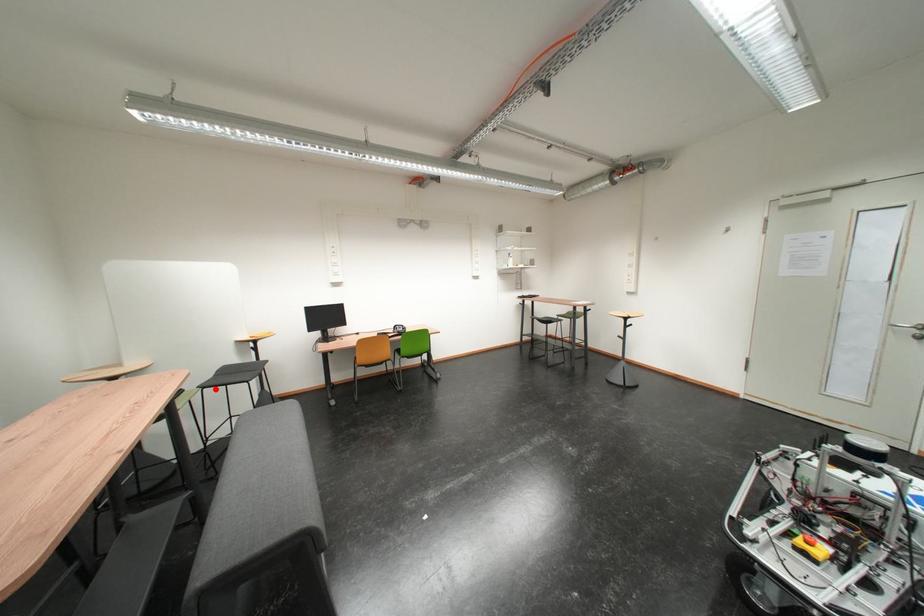
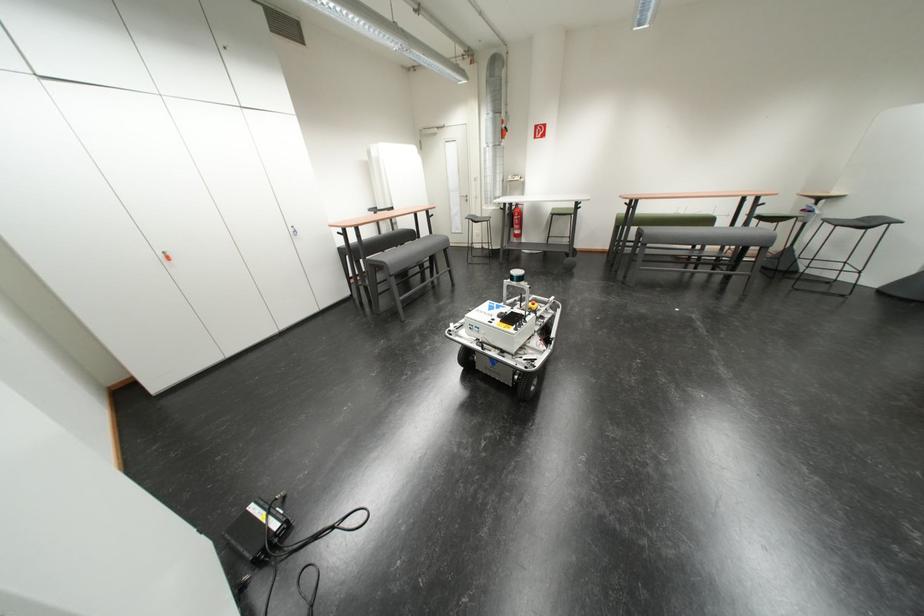
Question: I am providing you with two images of the same scene from different viewpoints. Image1 has a red point marked. In image2, the corresponding 3D location appears at what relative position? Reply with the corresponding letter.

Choices:
 (A) Closer
 (B) Farther

Answer: (B)